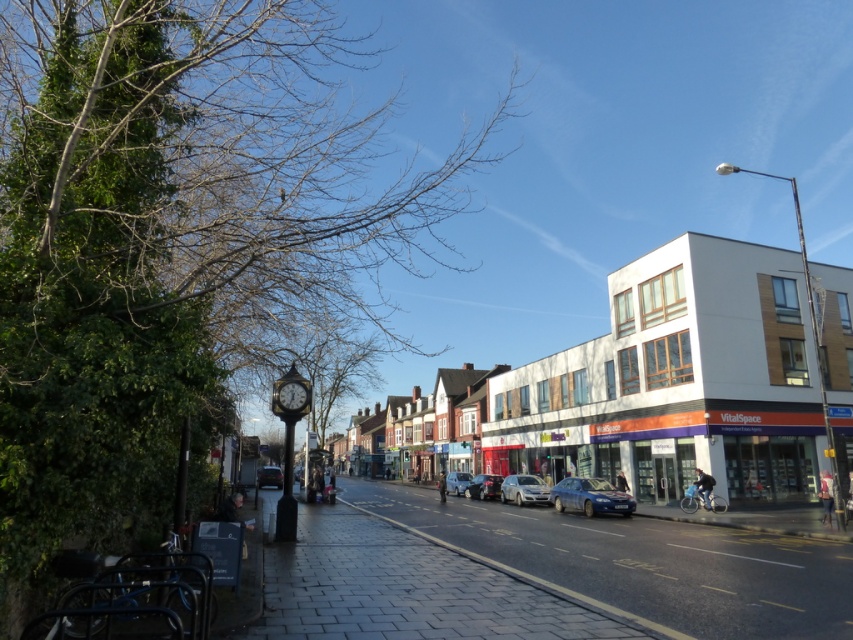
Question: Does shiny metallic car at center appear on the right side of metallic clock at center-left?

Choices:
 (A) yes
 (B) no

Answer: (A)

Question: Which point is closer to the camera taking this photo?

Choices:
 (A) [x=453, y=472]
 (B) [x=300, y=388]
 (C) [x=467, y=492]

Answer: (B)

Question: Which of the following is the farthest from the observer?

Choices:
 (A) dark gray metallic car at center
 (B) shiny metallic car at center
 (C) metallic clock at center-left

Answer: (A)

Question: Which of the following is the closest to the observer?

Choices:
 (A) shiny metallic car at center
 (B) metallic clock at center-left

Answer: (B)

Question: Is metallic clock at center-left wider than dark gray metallic car at center?

Choices:
 (A) yes
 (B) no

Answer: (B)

Question: Is blue metallic car at center further to the viewer compared to satin silver car at center?

Choices:
 (A) yes
 (B) no

Answer: (B)